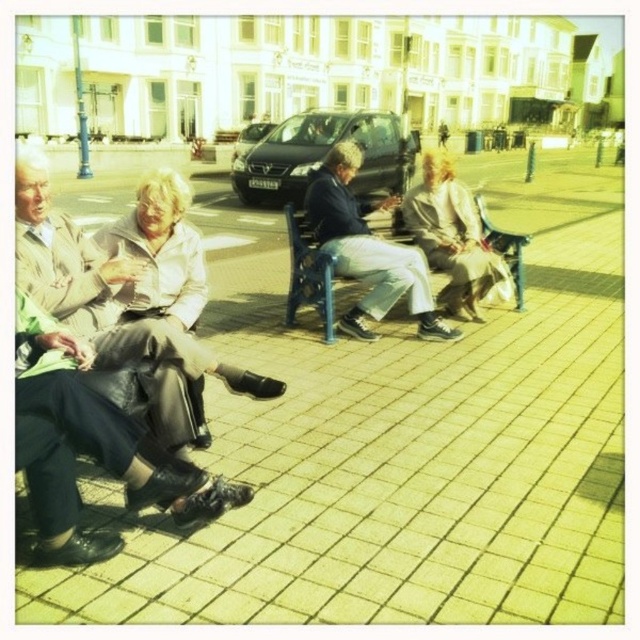
Is yellow brick pavement at center taller than light beige leather jacket at left?

Yes, yellow brick pavement at center is taller than light beige leather jacket at left.

Can you confirm if yellow brick pavement at center is positioned to the left of light beige leather jacket at left?

Incorrect, yellow brick pavement at center is not on the left side of light beige leather jacket at left.

Identify the location of yellow brick pavement at center. click(x=404, y=452).

Who is higher up, light blue fabric jacket at center or light beige fabric coat at center?

light blue fabric jacket at center is higher up.

What do you see at coordinates (368, 250) in the screenshot?
I see `light blue fabric jacket at center` at bounding box center [368, 250].

Locate an element on the screen. The height and width of the screenshot is (640, 640). light blue fabric jacket at center is located at coordinates (368, 250).

Based on the photo, does light beige leather jacket at left appear under light beige fabric coat at center?

Yes.

Who is more distant from viewer, (24, 214) or (448, 212)?

Point (448, 212)

The width and height of the screenshot is (640, 640). Identify the location of light beige leather jacket at left. (104, 305).